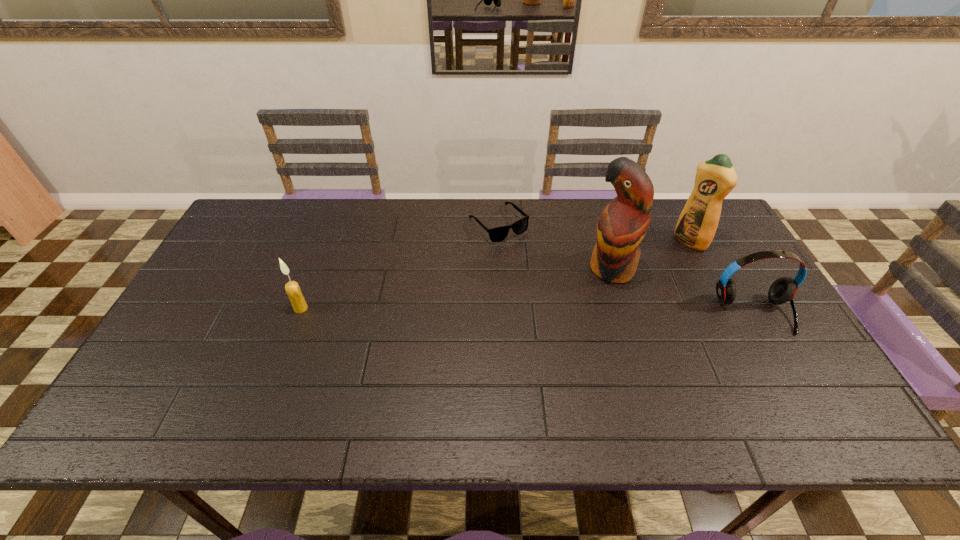
Locate an element on the screen. This screenshot has height=540, width=960. headset positioned at the right edge is located at coordinates (782, 290).

Locate an element on the screen. Image resolution: width=960 pixels, height=540 pixels. detergent situated at the right edge is located at coordinates (715, 178).

The image size is (960, 540). Find the location of `object that is at the far right corner`. object that is at the far right corner is located at coordinates (715, 178).

In the image, there is a desktop. At what (x,y) coordinates should I click in order to perform the action: click on vacant space at the far edge. Please return your answer as a coordinate pair (x, y). Looking at the image, I should click on (534, 232).

What are the coordinates of `vacant space at the near edge of the desktop` in the screenshot? It's located at (348, 384).

At what (x,y) coordinates should I click in order to perform the action: click on vacant space at the left edge. Please return your answer as a coordinate pair (x, y). Looking at the image, I should click on (210, 329).

Image resolution: width=960 pixels, height=540 pixels. What are the coordinates of `vacant space at the far left corner` in the screenshot? It's located at (263, 237).

Identify the location of free space at the far right corner. The image size is (960, 540). (675, 207).

In the image, there is a desktop. At what (x,y) coordinates should I click in order to perform the action: click on vacant region at the near right corner. Please return your answer as a coordinate pair (x, y). This screenshot has height=540, width=960. Looking at the image, I should click on (767, 394).

I want to click on unoccupied position between the sunglasses and the detergent, so [x=594, y=233].